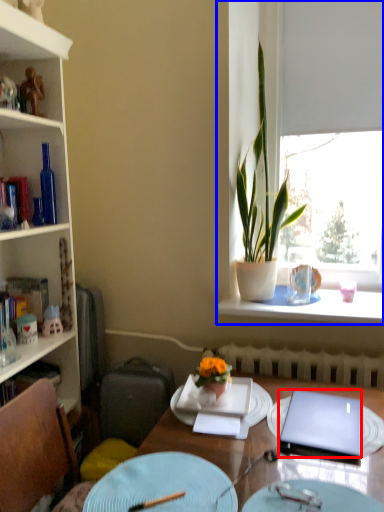
Question: Which of the following is the farthest to the observer, laptop (highlighted by a red box) or window (highlighted by a blue box)?

Choices:
 (A) laptop
 (B) window

Answer: (B)